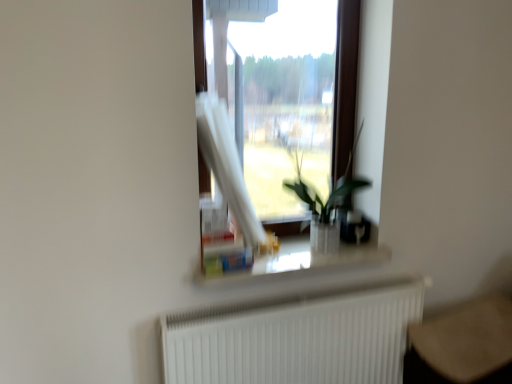
This screenshot has width=512, height=384. Identify the location of white glossy window sill at center. (297, 263).

What is the approximate height of transparent glass window at center?

transparent glass window at center is 3.77 feet in height.

Identify the location of white glossy window sill at center. The height and width of the screenshot is (384, 512). (297, 263).

Consider the image. Considering the relative sizes of white glossy window sill at center and white matte radiator at lower center in the image provided, is white glossy window sill at center thinner than white matte radiator at lower center?

No, white glossy window sill at center is not thinner than white matte radiator at lower center.

From the image's perspective, is white glossy window sill at center positioned above or below white matte radiator at lower center?

white glossy window sill at center is situated higher than white matte radiator at lower center in the image.

How much distance is there between white glossy window sill at center and white matte radiator at lower center?

9.12 inches.

Which point is more forward, (317, 272) or (343, 339)?

The point (343, 339) is more forward.

Would you say transparent glass window at center is a long distance from white glossy window sill at center?

That's right, there is a large distance between transparent glass window at center and white glossy window sill at center.

Can we say transparent glass window at center lies outside white glossy window sill at center?

Yes, transparent glass window at center is outside of white glossy window sill at center.

From the image's perspective, between transparent glass window at center and white glossy window sill at center, which one is located above?

transparent glass window at center is shown above in the image.

Is transparent glass window at center positioned with its back to white glossy window sill at center?

No, white glossy window sill at center is not at the back of transparent glass window at center.

Does green leafy plant at center have a lesser width compared to white glossy window sill at center?

No.

Is green leafy plant at center next to white glossy window sill at center?

No, green leafy plant at center is not with white glossy window sill at center.

From a real-world perspective, is green leafy plant at center physically below white glossy window sill at center?

No, from a real-world perspective, green leafy plant at center is not under white glossy window sill at center.

Identify the location of houseplant in front of the white glossy window sill at center. The image size is (512, 384). pyautogui.click(x=325, y=202).

Where is `radiator below the transparent glass window at center (from the image's perspective)`? radiator below the transparent glass window at center (from the image's perspective) is located at coordinates (297, 337).

From the image's perspective, is transparent glass window at center located above or below white matte radiator at lower center?

Based on their image positions, transparent glass window at center is located above white matte radiator at lower center.

Looking at this image, relative to white matte radiator at lower center, is transparent glass window at center in front or behind?

Clearly, transparent glass window at center is behind white matte radiator at lower center.

Considering the relative sizes of transparent glass window at center and white matte radiator at lower center in the image provided, is transparent glass window at center bigger than white matte radiator at lower center?

No, transparent glass window at center is not bigger than white matte radiator at lower center.

From the image's perspective, would you say white matte radiator at lower center is shown under green leafy plant at center?

Yes, from the image's perspective, white matte radiator at lower center is beneath green leafy plant at center.

From a real-world perspective, does white matte radiator at lower center sit lower than green leafy plant at center?

Yes.

Is white matte radiator at lower center facing away from green leafy plant at center?

No, green leafy plant at center is not at the back of white matte radiator at lower center.

Is white matte radiator at lower center positioned far away from green leafy plant at center?

No, white matte radiator at lower center is in close proximity to green leafy plant at center.

Is white matte radiator at lower center facing towards white glossy window sill at center?

No, white matte radiator at lower center is not oriented towards white glossy window sill at center.

Choose the correct answer: Is white matte radiator at lower center inside white glossy window sill at center or outside it?

white matte radiator at lower center is not inside white glossy window sill at center, it's outside.

Looking at this image, in the image, is white matte radiator at lower center positioned in front of or behind white glossy window sill at center?

Visually, white matte radiator at lower center is located in front of white glossy window sill at center.

Can you tell me how much white matte radiator at lower center and transparent glass window at center differ in facing direction?

The facing directions of white matte radiator at lower center and transparent glass window at center are 0.474 degrees apart.

Is white matte radiator at lower center positioned with its back to transparent glass window at center?

No, white matte radiator at lower center's orientation is not away from transparent glass window at center.

This screenshot has height=384, width=512. Find the location of `window lying on the left of white matte radiator at lower center`. window lying on the left of white matte radiator at lower center is located at coordinates (278, 127).

Is white matte radiator at lower center shorter than transparent glass window at center?

Indeed, white matte radiator at lower center has a lesser height compared to transparent glass window at center.

Image resolution: width=512 pixels, height=384 pixels. Find the location of `window sill above the white matte radiator at lower center (from a real-world perspective)`. window sill above the white matte radiator at lower center (from a real-world perspective) is located at coordinates (297, 263).

You are a GUI agent. You are given a task and a screenshot of the screen. Output one action in this format:
    pyautogui.click(x=<x>, y=<y>)
    Task: Click on the window that appears behind the white glossy window sill at center
    This screenshot has height=384, width=512.
    Given the screenshot: What is the action you would take?
    pyautogui.click(x=278, y=127)

From the image, which object appears to be nearer to white matte radiator at lower center, green leafy plant at center or transparent glass window at center?

green leafy plant at center.

Looking at the image, which one is located further to white matte radiator at lower center, white glossy window sill at center or transparent glass window at center?

transparent glass window at center is further to white matte radiator at lower center.

From the image, which object appears to be nearer to white glossy window sill at center, green leafy plant at center or white matte radiator at lower center?

green leafy plant at center is closer to white glossy window sill at center.

Looking at the image, which one is located further to transparent glass window at center, white glossy window sill at center or white matte radiator at lower center?

white glossy window sill at center lies further to transparent glass window at center than the other object.

From the image, which object appears to be nearer to green leafy plant at center, transparent glass window at center or white matte radiator at lower center?

Based on the image, white matte radiator at lower center appears to be nearer to green leafy plant at center.

Looking at the image, which one is located further to green leafy plant at center, transparent glass window at center or white glossy window sill at center?

Among the two, transparent glass window at center is located further to green leafy plant at center.

Looking at the image, which one is located further to green leafy plant at center, white glossy window sill at center or white matte radiator at lower center?

white matte radiator at lower center is positioned further to the anchor green leafy plant at center.

Which object lies further to the anchor point white glossy window sill at center, white matte radiator at lower center or transparent glass window at center?

Among the two, transparent glass window at center is located further to white glossy window sill at center.

Image resolution: width=512 pixels, height=384 pixels. In order to click on houseplant between transparent glass window at center and white glossy window sill at center in the up-down direction in this screenshot , I will do `click(325, 202)`.

Image resolution: width=512 pixels, height=384 pixels. I want to click on houseplant between transparent glass window at center and white matte radiator at lower center vertically, so click(325, 202).

The height and width of the screenshot is (384, 512). I want to click on window sill between transparent glass window at center and white matte radiator at lower center from top to bottom, so coord(297,263).

This screenshot has width=512, height=384. Identify the location of window sill between green leafy plant at center and white matte radiator at lower center vertically. (297, 263).